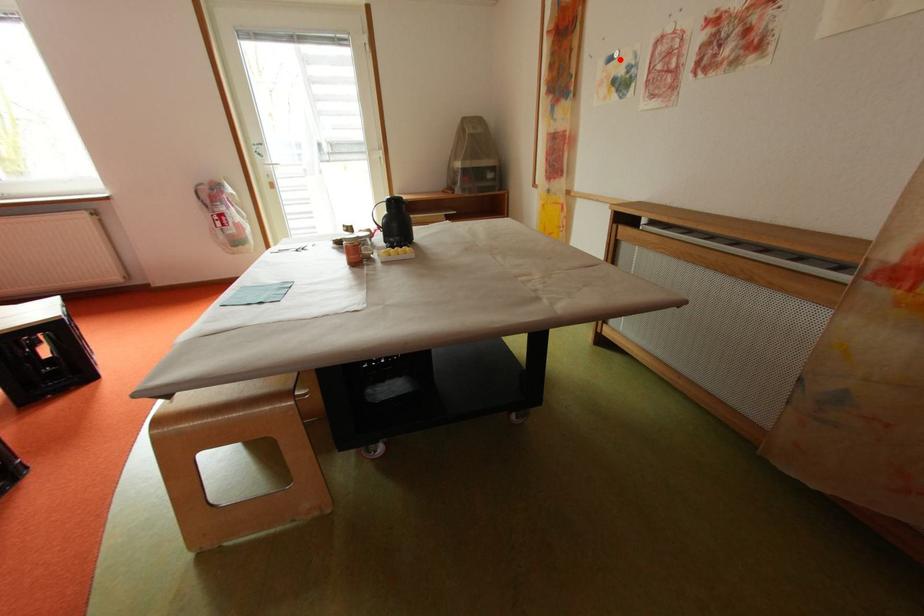
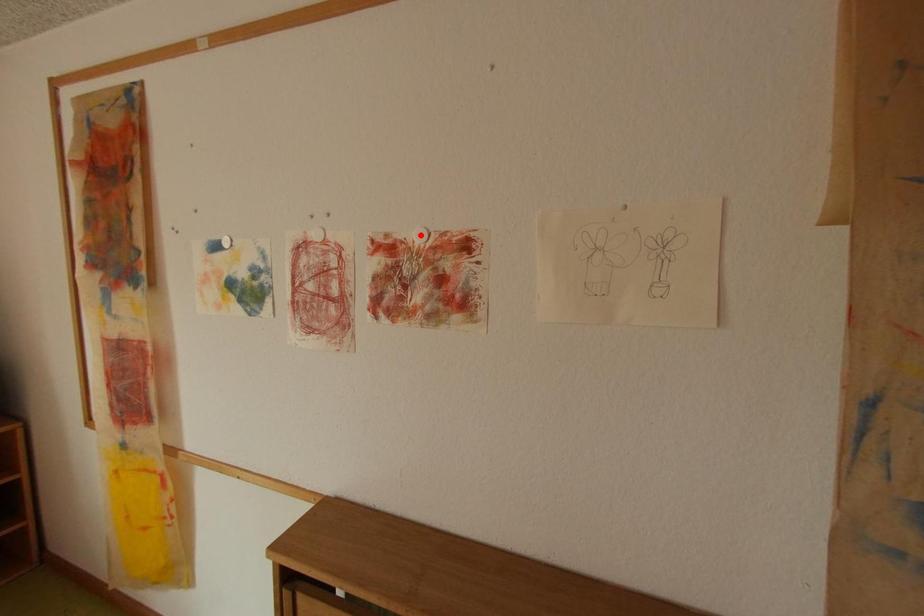
I am providing you with two images of the same scene from different viewpoints. A red point is marked on the first image and another point is marked on the second image. Does the point marked in image1 correspond to the same location as the one in image2?

No